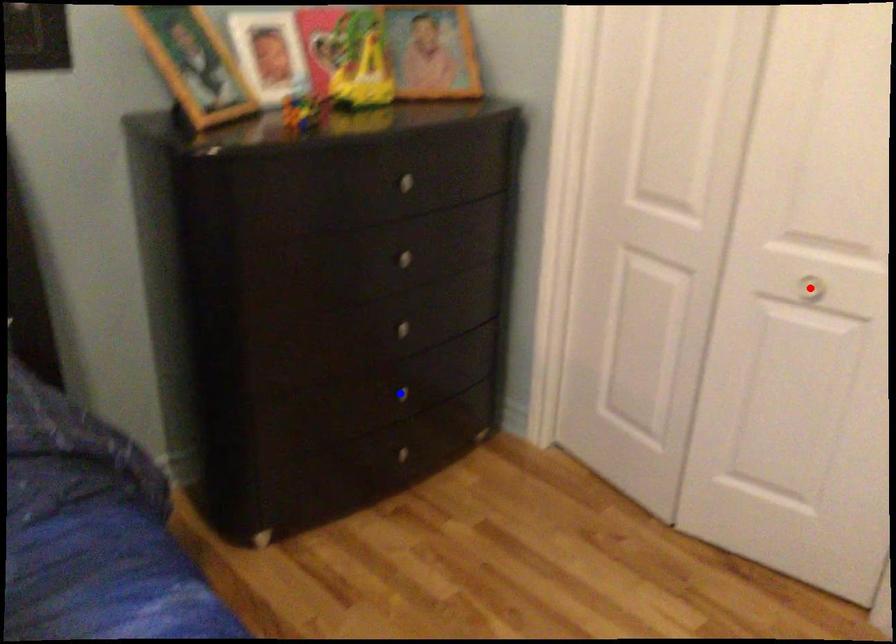
Question: Which of the two points in the image is closer to the camera?

Choices:
 (A) Blue point is closer.
 (B) Red point is closer.

Answer: (B)